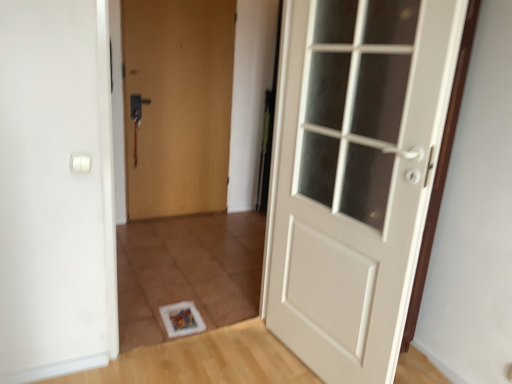
This screenshot has height=384, width=512. I want to click on free spot to the left of white glossy door at center, which ranks as the 2th door in back-to-front order, so click(x=239, y=363).